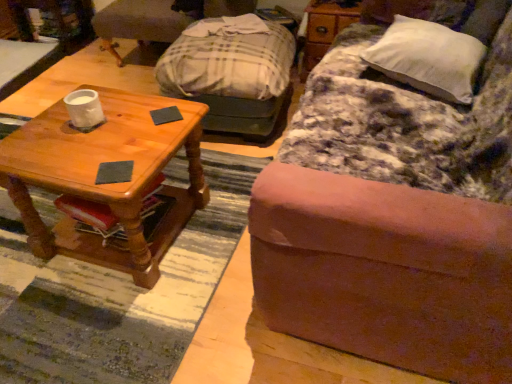
Question: Is gray felt coaster at center, which is the 2th pad from top to bottom, in contact with dark gray matte coaster at center, which is the 2th pad in bottom-to-top order?

Choices:
 (A) no
 (B) yes

Answer: (A)

Question: Considering the relative sizes of gray felt coaster at center, which is the 2th pad from top to bottom, and dark gray matte coaster at center, acting as the 1th pad starting from the top, in the image provided, is gray felt coaster at center, which is the 2th pad from top to bottom, smaller than dark gray matte coaster at center, acting as the 1th pad starting from the top,?

Choices:
 (A) yes
 (B) no

Answer: (A)

Question: Is gray felt coaster at center, arranged as the second pad when viewed from the back, at the right side of dark gray matte coaster at center, the 2th pad in the front-to-back sequence?

Choices:
 (A) yes
 (B) no

Answer: (B)

Question: Are gray felt coaster at center, marked as the first pad in a front-to-back arrangement, and dark gray matte coaster at center, which is the 1th pad from back to front, far apart?

Choices:
 (A) no
 (B) yes

Answer: (A)

Question: From a real-world perspective, is gray felt coaster at center, which appears as the 1th pad when ordered from the bottom, positioned over dark gray matte coaster at center, which is the 1th pad from back to front, based on gravity?

Choices:
 (A) yes
 (B) no

Answer: (B)

Question: Considering the relative positions of gray felt coaster at center, marked as the first pad in a front-to-back arrangement, and dark gray matte coaster at center, acting as the 1th pad starting from the top, in the image provided, is gray felt coaster at center, marked as the first pad in a front-to-back arrangement, to the left of dark gray matte coaster at center, acting as the 1th pad starting from the top, from the viewer's perspective?

Choices:
 (A) no
 (B) yes

Answer: (B)

Question: Is the position of wooden coffee table at left less distant than that of brushed metal desk at upper left?

Choices:
 (A) no
 (B) yes

Answer: (B)

Question: Would you say wooden coffee table at left is outside brushed metal desk at upper left?

Choices:
 (A) no
 (B) yes

Answer: (B)

Question: From the image's perspective, is wooden coffee table at left on brushed metal desk at upper left?

Choices:
 (A) no
 (B) yes

Answer: (A)

Question: Is wooden coffee table at left not near brushed metal desk at upper left?

Choices:
 (A) no
 (B) yes

Answer: (B)

Question: Is wooden coffee table at left shorter than brushed metal desk at upper left?

Choices:
 (A) no
 (B) yes

Answer: (A)

Question: Is wooden coffee table at left touching brushed metal desk at upper left?

Choices:
 (A) yes
 (B) no

Answer: (B)

Question: Considering the relative sizes of wooden coffee table at left and wooden dresser at upper right in the image provided, is wooden coffee table at left shorter than wooden dresser at upper right?

Choices:
 (A) no
 (B) yes

Answer: (A)